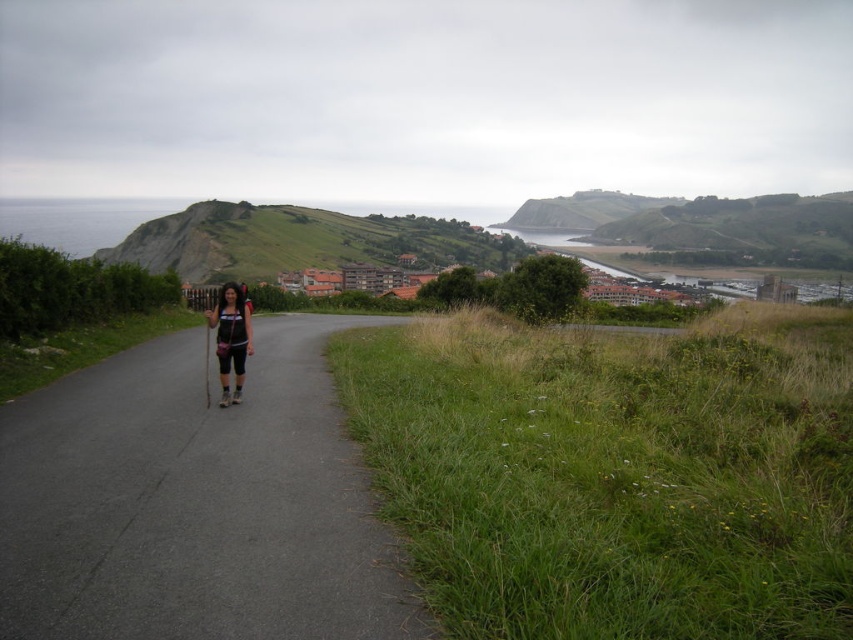
Question: Which object appears farthest from the camera in this image?

Choices:
 (A) green grassy hillside at upper center
 (B) asphalt road at center

Answer: (A)

Question: Is green grassy hillside at upper center above matte black shorts at center?

Choices:
 (A) no
 (B) yes

Answer: (B)

Question: Can you confirm if green grassy hillside at center is wider than matte black shorts at center?

Choices:
 (A) yes
 (B) no

Answer: (A)

Question: Which object is closer to the camera taking this photo?

Choices:
 (A) asphalt road at center
 (B) green grassy hillside at upper center
 (C) green grassy hillside at center
 (D) matte black shorts at center

Answer: (A)

Question: In this image, where is asphalt road at center located relative to green grassy hillside at center?

Choices:
 (A) below
 (B) above

Answer: (A)

Question: Which object is the farthest from the matte black shorts at center?

Choices:
 (A) green grassy hillside at center
 (B) asphalt road at center
 (C) green grassy hillside at upper center

Answer: (C)